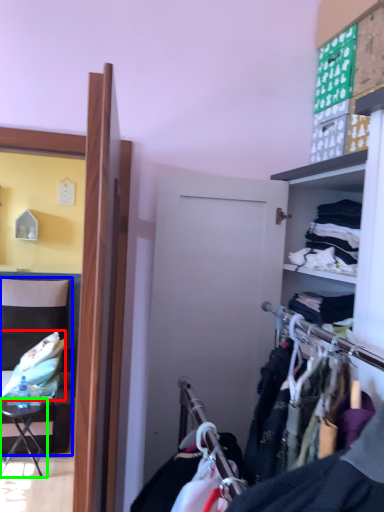
Question: Which object is positioned closest to clothing (highlighted by a red box)? Select from chair (highlighted by a blue box) and table (highlighted by a green box).

Choices:
 (A) chair
 (B) table

Answer: (B)